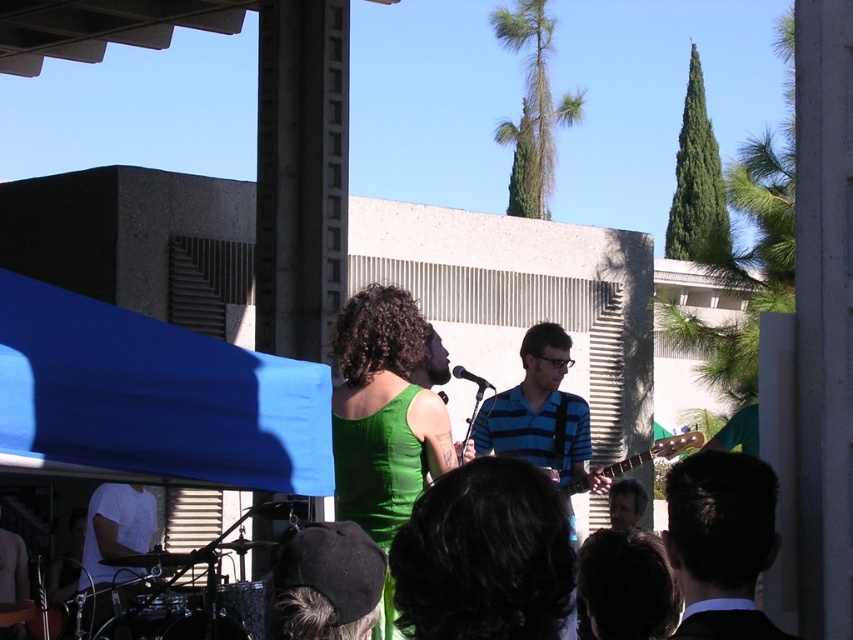
Question: Does black suit at upper right have a lesser width compared to blue striped shirt at center?

Choices:
 (A) yes
 (B) no

Answer: (B)

Question: Which object is farther from the camera taking this photo?

Choices:
 (A) black felt hat at lower center
 (B) blue striped shirt at center
 (C) brown wooden guitar at center
 (D) white t-shirt at lower left

Answer: (D)

Question: Is black suit at upper right above blue striped shirt at center?

Choices:
 (A) no
 (B) yes

Answer: (A)

Question: Which object appears closest to the camera in this image?

Choices:
 (A) black suit at upper right
 (B) matte green tank top at center
 (C) brown wooden guitar at center
 (D) green fabric tank top at center

Answer: (A)

Question: Which is farther from the brown wooden guitar at center?

Choices:
 (A) blue striped shirt at center
 (B) matte green tank top at center
 (C) black felt hat at lower center
 (D) black suit at upper right

Answer: (C)

Question: Can you confirm if blue striped shirt at center is thinner than black felt hat at lower center?

Choices:
 (A) no
 (B) yes

Answer: (B)